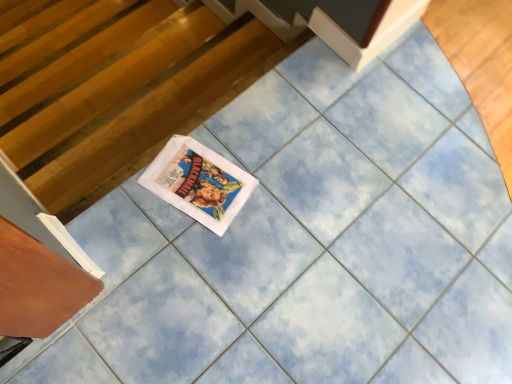
The image size is (512, 384). In order to click on free space above white paper comic book at center (from a real-world perspective) in this screenshot , I will do `click(197, 182)`.